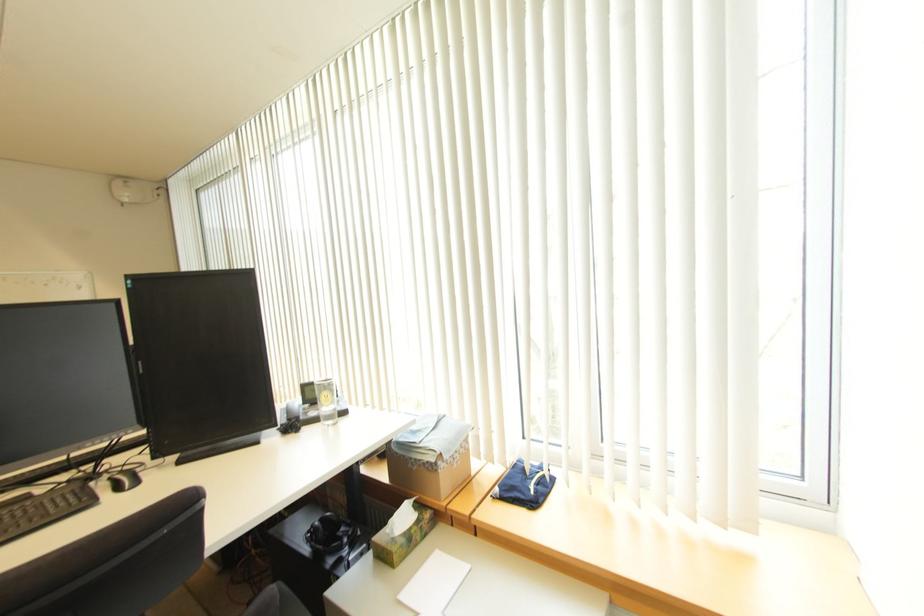
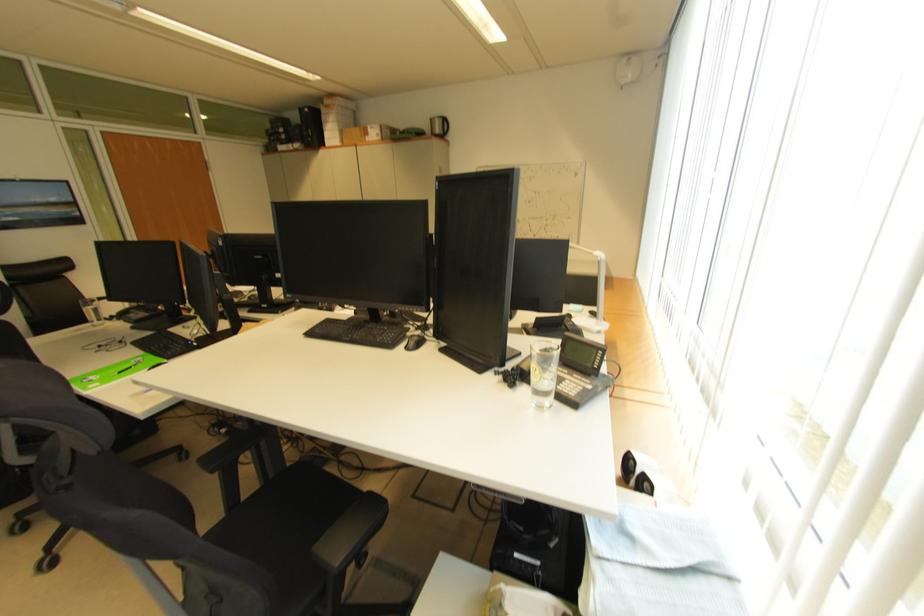
Consider the image. First-person continuous shooting, in which direction is the camera rotating?

The camera's rotation is toward left-down.